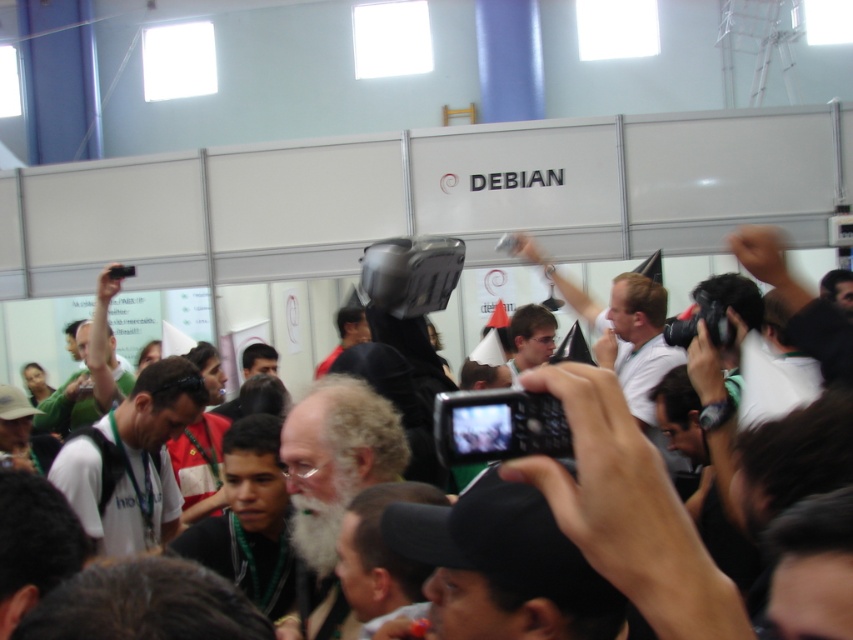
Question: Which object is the closest to the green fabric shirt at center?

Choices:
 (A) matte black glasses at center
 (B) white matte shirt at center

Answer: (B)

Question: Estimate the real-world distances between objects in this image. Which object is closer to the green fabric shirt at center?

Choices:
 (A) matte black glasses at center
 (B) white matte shirt at center

Answer: (B)

Question: Can you confirm if white matte shirt at center is positioned to the right of green fabric shirt at center?

Choices:
 (A) yes
 (B) no

Answer: (A)

Question: Which of the following is the farthest from the observer?

Choices:
 (A) pos(517,324)
 (B) pos(157,432)

Answer: (A)

Question: Does white matte shirt at center appear on the right side of matte black glasses at center?

Choices:
 (A) yes
 (B) no

Answer: (B)

Question: Does white matte shirt at center appear over matte black glasses at center?

Choices:
 (A) no
 (B) yes

Answer: (A)